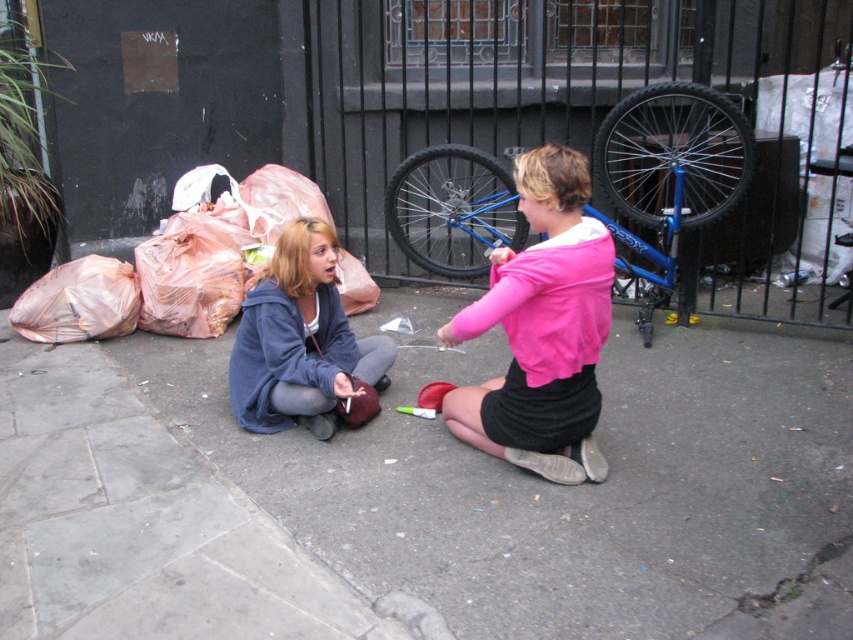
Does blue metallic bicycle at upper center have a smaller size compared to matte blue hoodie at center?

No, blue metallic bicycle at upper center is not smaller than matte blue hoodie at center.

At what (x,y) coordinates should I click in order to perform the action: click on blue metallic bicycle at upper center. Please return your answer as a coordinate pair (x, y). Looking at the image, I should click on (670, 168).

Find the location of a particular element. This screenshot has width=853, height=640. blue metallic bicycle at upper center is located at coordinates (670, 168).

Which is in front, point (735, 198) or point (248, 266)?

Point (735, 198) is in front.

Is blue metallic bicycle at upper center shorter than plastic bags at lower left?

Incorrect, blue metallic bicycle at upper center's height does not fall short of plastic bags at lower left's.

Is point (746, 129) positioned behind point (177, 285)?

No, it is in front of (177, 285).

You are a GUI agent. You are given a task and a screenshot of the screen. Output one action in this format:
    pyautogui.click(x=<x>, y=<y>)
    Task: Click on the blue metallic bicycle at upper center
    This screenshot has height=640, width=853.
    Given the screenshot: What is the action you would take?
    pyautogui.click(x=670, y=168)

Between plastic bags at lower left and matte blue hoodie at center, which one is positioned lower?

matte blue hoodie at center

Is plastic bags at lower left shorter than matte blue hoodie at center?

In fact, plastic bags at lower left may be taller than matte blue hoodie at center.

Does point (141, 289) come closer to viewer compared to point (386, 365)?

No.

Identify the location of plastic bags at lower left. (171, 269).